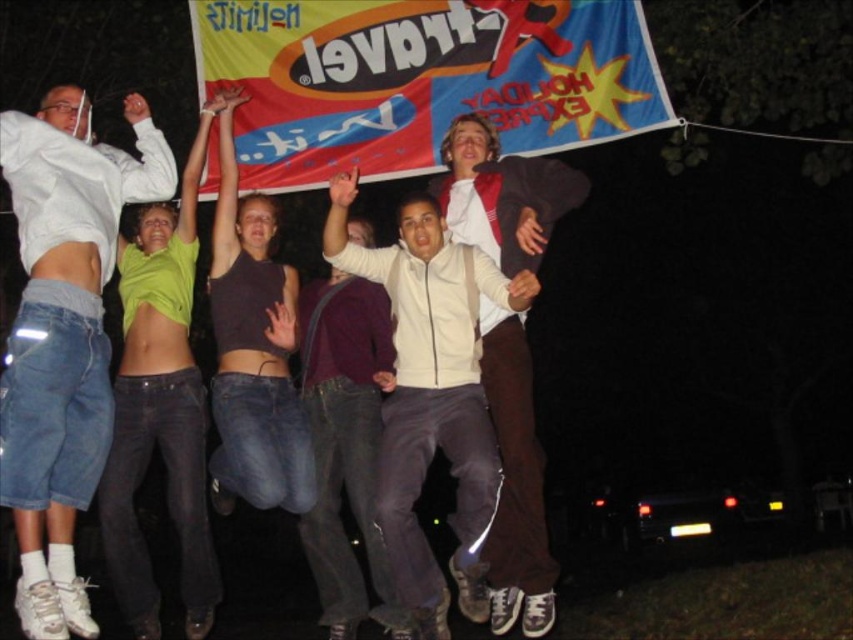
You are part of the group jumping in the air under the banner. You want to know which jacket is closer to you between the white matte jacket at center and the brown leather jacket at center. Which one is closer?

The white matte jacket at center is closer to you because it is in front of the brown leather jacket at center.

You are a photographer trying to capture a clear shot of the white cotton hoodie at upper left. Based on its position in the image coordinates, which corner of the photo should you focus on?

The white cotton hoodie at upper left is located at point (x=62, y=336), which corresponds to the upper left corner of the photo. Therefore, you should focus on the upper left corner to capture it clearly.

You are at a nighttime event and see the red fabric banner at upper center and the brown leather jacket at center. Which object is positioned to the left when viewed from your perspective?

The red fabric banner at upper center is to the left of the brown leather jacket at center, so the red fabric banner at upper center is positioned to the left.